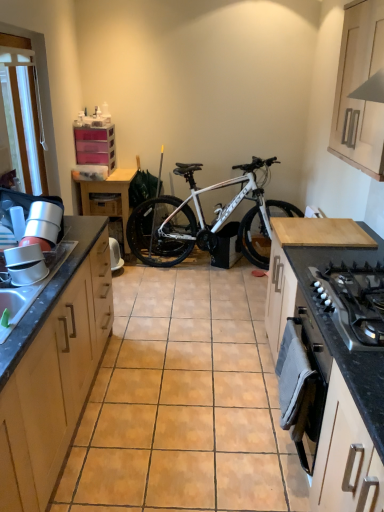
Question: Based on their sizes in the image, would you say silver metallic gas stove at lower right is bigger or smaller than wooden cabinet at left, the second cabinetry positioned from the left?

Choices:
 (A) small
 (B) big

Answer: (A)

Question: Is silver metallic gas stove at lower right in front of or behind wooden cabinet at left, placed as the third cabinetry when sorted from back to front, in the image?

Choices:
 (A) front
 (B) behind

Answer: (B)

Question: Estimate the real-world distances between objects in this image. Which object is farther from the white glossy sink at left?

Choices:
 (A) wooden drawer at center
 (B) black granite countertop at lower right
 (C) wooden table at left
 (D) white plastic screen door at upper left
 (E) white matte cabinet at upper right, marked as the fourth cabinetry in a left-to-right arrangement

Answer: (A)

Question: Based on their relative distances, which object is farther from the white glossy sink at left?

Choices:
 (A) wooden cabinet at left, placed as the third cabinetry when sorted from back to front
 (B) white matte bicycle at center
 (C) white matte cabinet at upper right, the second cabinetry from the back
 (D) transparent plastic drawers at upper left, the first cabinetry viewed from the back
 (E) wooden table at left

Answer: (B)